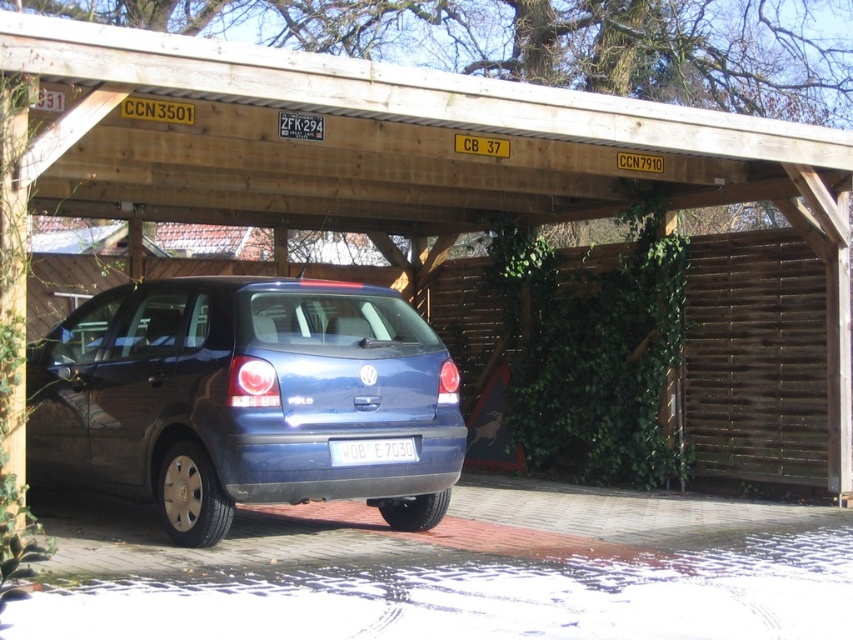
Is matte blue hatchback at center thinner than white plastic license plate at rear?

No, matte blue hatchback at center is not thinner than white plastic license plate at rear.

Which is behind, point (183, 544) or point (344, 440)?

Positioned behind is point (183, 544).

Between point (224, 500) and point (334, 461), which one is positioned in front?

Point (334, 461) is more forward.

This screenshot has width=853, height=640. I want to click on matte blue hatchback at center, so click(x=244, y=397).